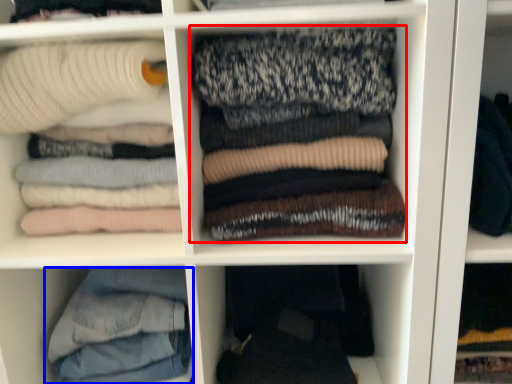
Question: Which of the following is the closest to the observer, laundry (highlighted by a red box) or trousers (highlighted by a blue box)?

Choices:
 (A) laundry
 (B) trousers

Answer: (A)